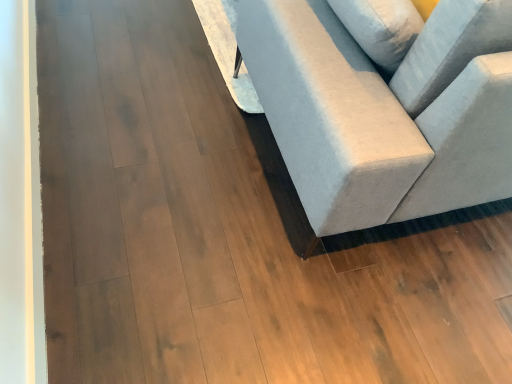
Question: Should I look upward or downward to see light gray fabric couch at right?

Choices:
 (A) up
 (B) down

Answer: (A)